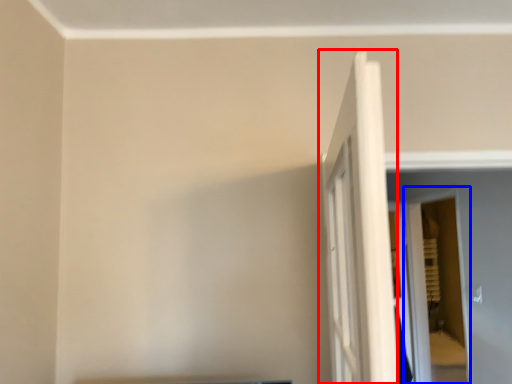
Question: Which object is closer to the camera taking this photo, door (highlighted by a red box) or screen door (highlighted by a blue box)?

Choices:
 (A) door
 (B) screen door

Answer: (A)